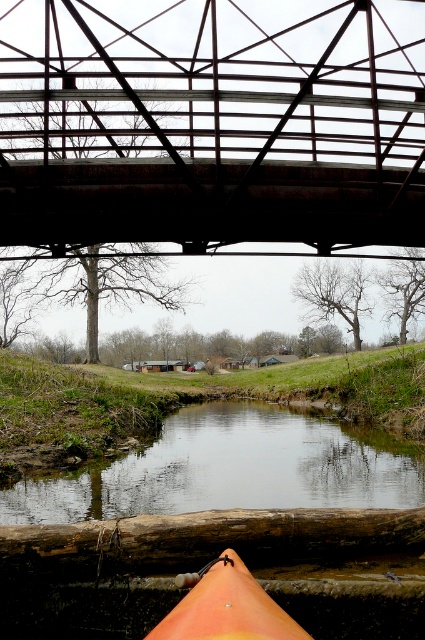
Does rusty metal bridge at upper center come behind orange matte canoe at lower center?

Yes, it is.

Is rusty metal bridge at upper center smaller than orange matte canoe at lower center?

Incorrect, rusty metal bridge at upper center is not smaller in size than orange matte canoe at lower center.

Is point (326, 168) farther from viewer compared to point (266, 618)?

That is True.

The width and height of the screenshot is (425, 640). I want to click on rusty metal bridge at upper center, so click(x=212, y=122).

Which is behind, point (19, 566) or point (231, 609)?

Point (19, 566)

Identify the location of brown rough wood log at lower center. (206, 540).

Who is more distant from viewer, (163,486) or (376,532)?

The point (163,486) is behind.

Who is more forward, (x=299, y=442) or (x=323, y=541)?

Point (x=323, y=541) is more forward.

Find the location of a particular element. The image size is (425, 640). smooth brown water at center is located at coordinates (231, 468).